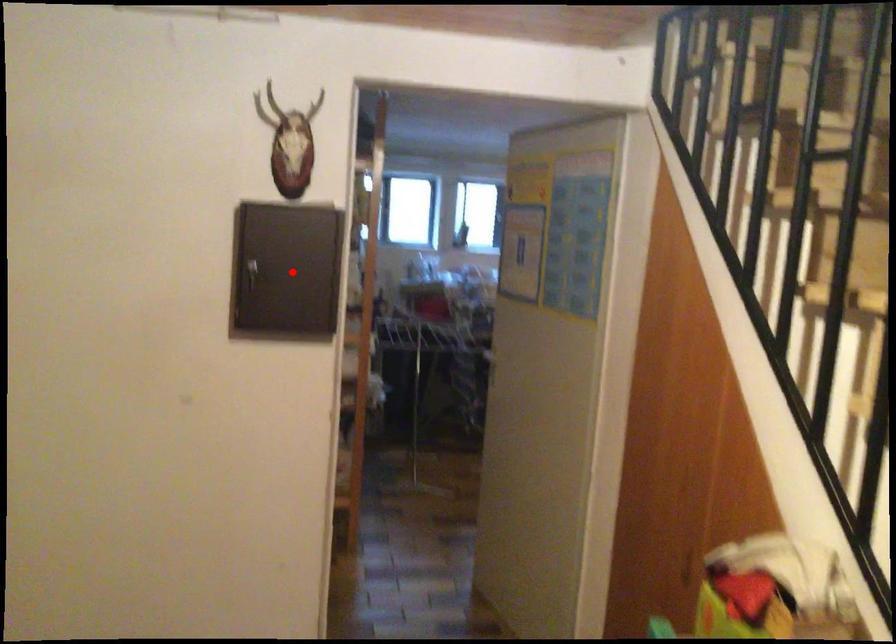
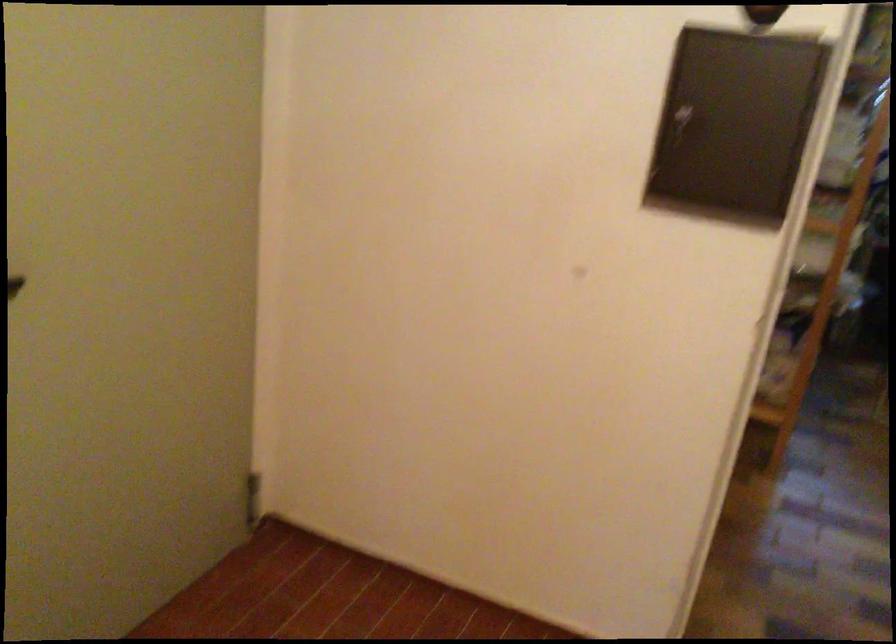
Question: I am providing you with two images of the same scene from different viewpoints. Given a red point in image1, look at the same physical point in image2. Is it:

Choices:
 (A) Closer to the viewpoint
 (B) Farther from the viewpoint

Answer: (A)